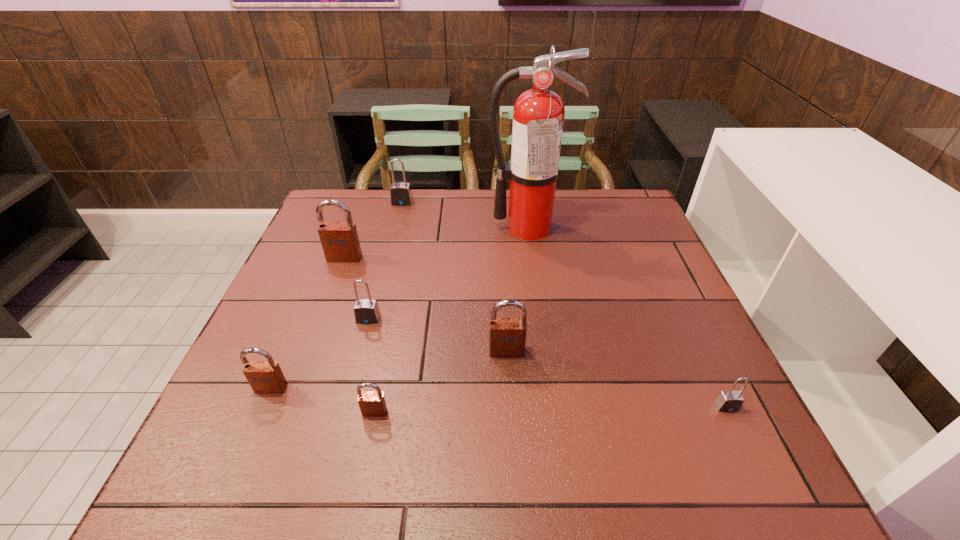
At what (x,y) coordinates should I click in order to perform the action: click on the second nearest brown padlock. Please return your answer as a coordinate pair (x, y). Looking at the image, I should click on (265, 377).

The width and height of the screenshot is (960, 540). Find the location of `the third nearest object`. the third nearest object is located at coordinates (265, 377).

At what (x,y) coordinates should I click in order to perform the action: click on the rightmost padlock. Please return your answer as a coordinate pair (x, y). This screenshot has width=960, height=540. Looking at the image, I should click on (729, 401).

Locate an element on the screen. the nearest gray padlock is located at coordinates (729, 401).

Locate an element on the screen. Image resolution: width=960 pixels, height=540 pixels. the smallest brown padlock is located at coordinates (372, 404).

You are a GUI agent. You are given a task and a screenshot of the screen. Output one action in this format:
    pyautogui.click(x=<x>, y=<y>)
    Task: Click on the nearest brown padlock
    
    Given the screenshot: What is the action you would take?
    pyautogui.click(x=372, y=404)

Locate an element on the screen. The height and width of the screenshot is (540, 960). free space located on the nozzle side of the fire extinguisher is located at coordinates (542, 332).

At what (x,y) coordinates should I click in order to perform the action: click on free space located on the front-facing side of the seventh shortest object. Please return your answer as a coordinate pair (x, y). This screenshot has height=540, width=960. Looking at the image, I should click on (338, 275).

Locate an element on the screen. vacant space situated on the shackle of the farthest object is located at coordinates (383, 280).

At what (x,y) coordinates should I click in order to perform the action: click on free space located 0.060m on the front-facing side of the third smallest brown padlock. Please return your answer as a coordinate pair (x, y). The height and width of the screenshot is (540, 960). Looking at the image, I should click on (508, 381).